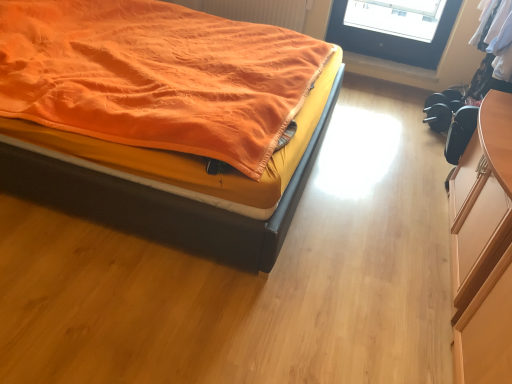
Question: Considering the positions of orange fabric bed at upper left and orange fabric radiator at upper center in the image, is orange fabric bed at upper left wider or thinner than orange fabric radiator at upper center?

Choices:
 (A) wide
 (B) thin

Answer: (A)

Question: Considering the positions of orange fabric bed at upper left and orange fabric radiator at upper center in the image, is orange fabric bed at upper left taller or shorter than orange fabric radiator at upper center?

Choices:
 (A) short
 (B) tall

Answer: (B)

Question: Estimate the real-world distances between objects in this image. Which object is closer to the wooden at lower right?

Choices:
 (A) orange fabric radiator at upper center
 (B) orange fabric bed at upper left

Answer: (A)

Question: Considering the real-world distances, which object is closest to the wooden at lower right?

Choices:
 (A) orange fabric bed at upper left
 (B) orange fabric radiator at upper center

Answer: (B)